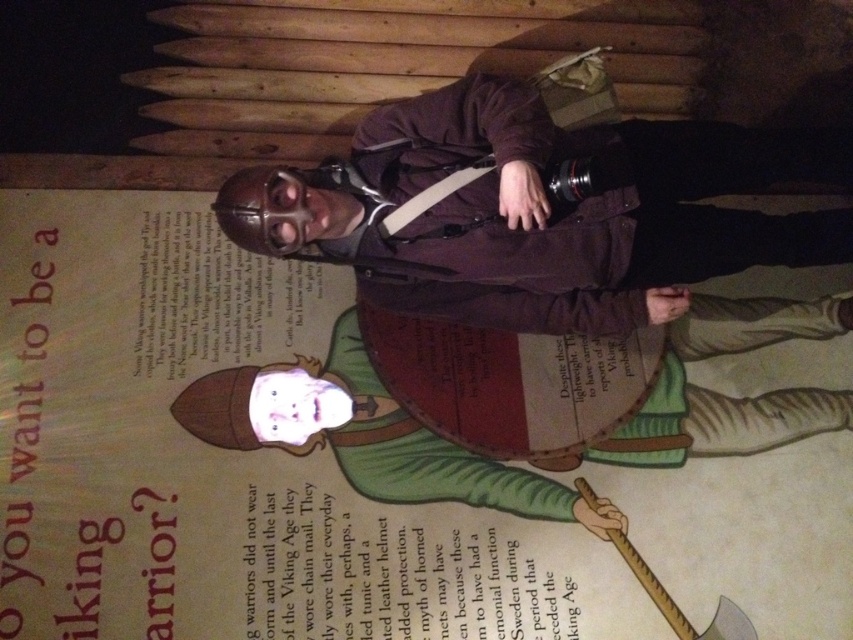
Is matte brown leather helmet at upper center shorter than green leather shield at center?

No, matte brown leather helmet at upper center is not shorter than green leather shield at center.

Which of these two, matte brown leather helmet at upper center or green leather shield at center, stands taller?

matte brown leather helmet at upper center

Describe the element at coordinates (540, 211) in the screenshot. The height and width of the screenshot is (640, 853). I see `matte brown leather helmet at upper center` at that location.

The height and width of the screenshot is (640, 853). What are the coordinates of `matte brown leather helmet at upper center` in the screenshot? It's located at click(540, 211).